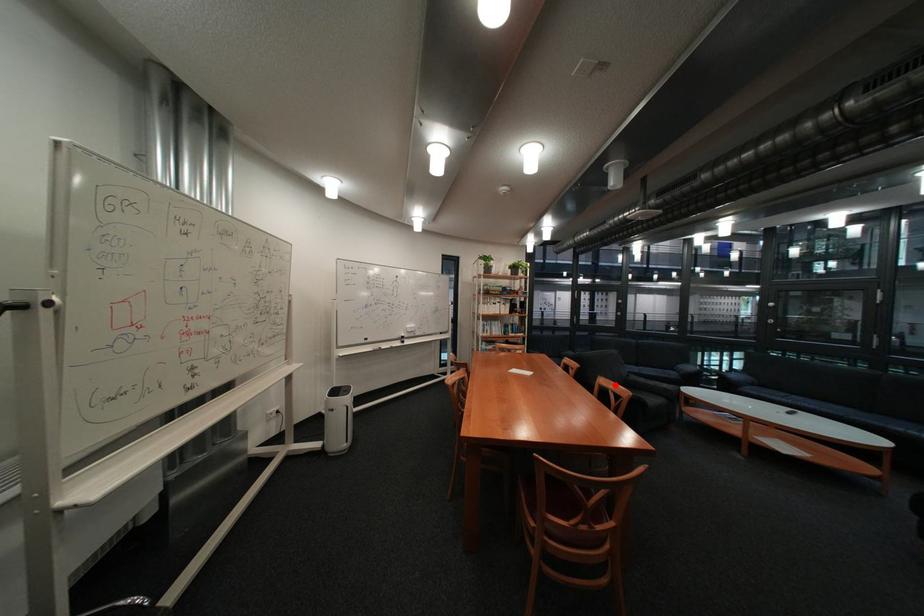
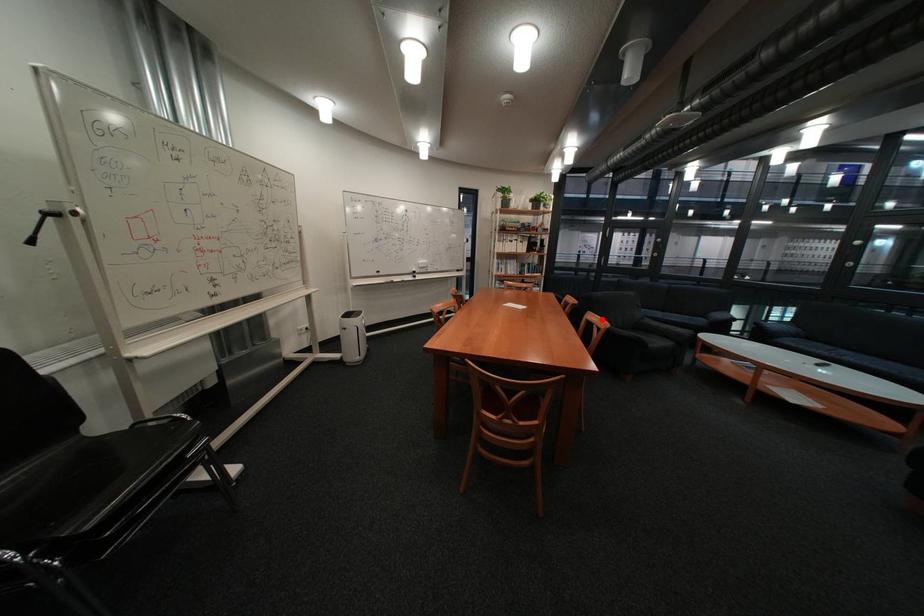
I am providing you with two images of the same scene from different viewpoints. A red point is marked on the first image and another point is marked on the second image. Are the points marked in image1 and image2 representing the same 3D position?

Yes